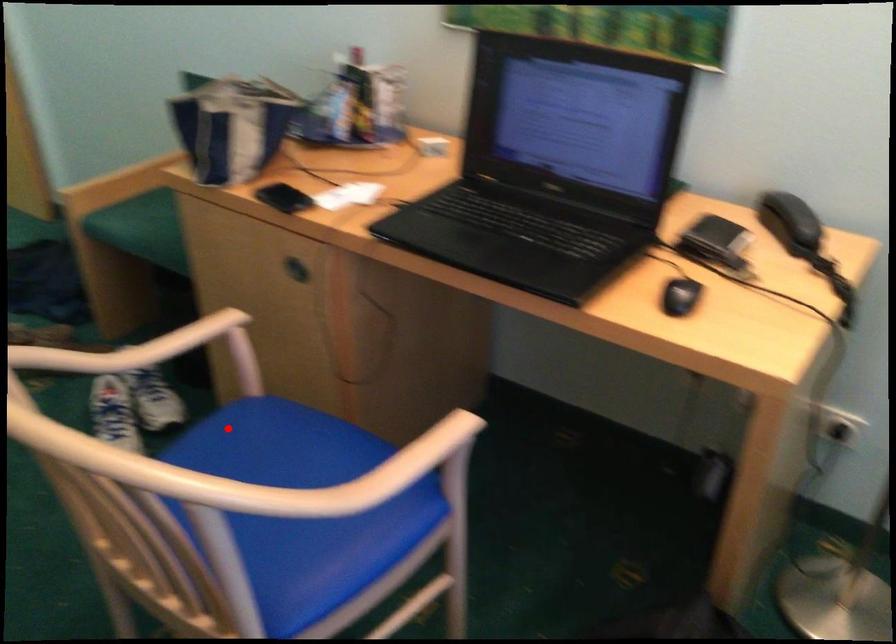
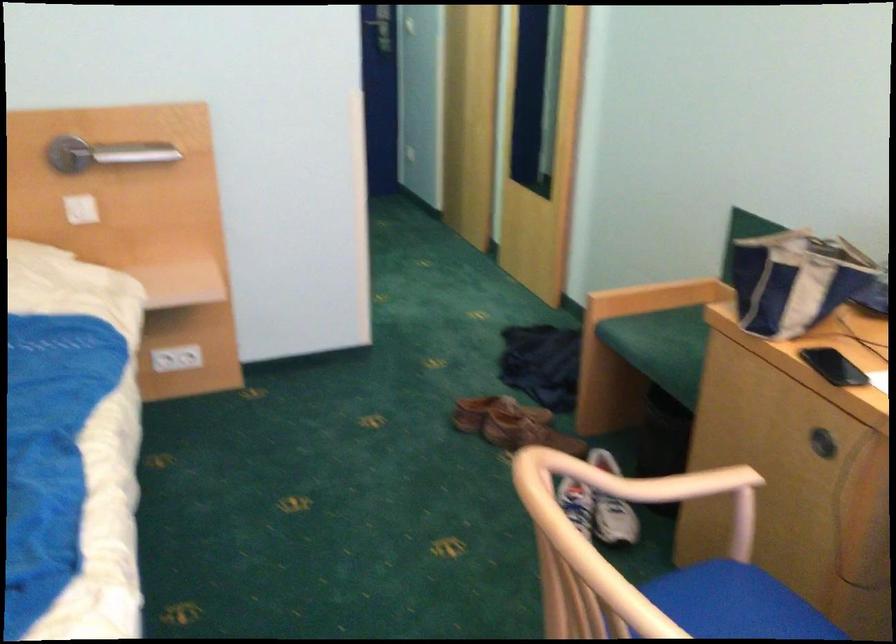
The point at the highlighted location is marked in the first image. Where is the corresponding point in the second image?

(711, 590)